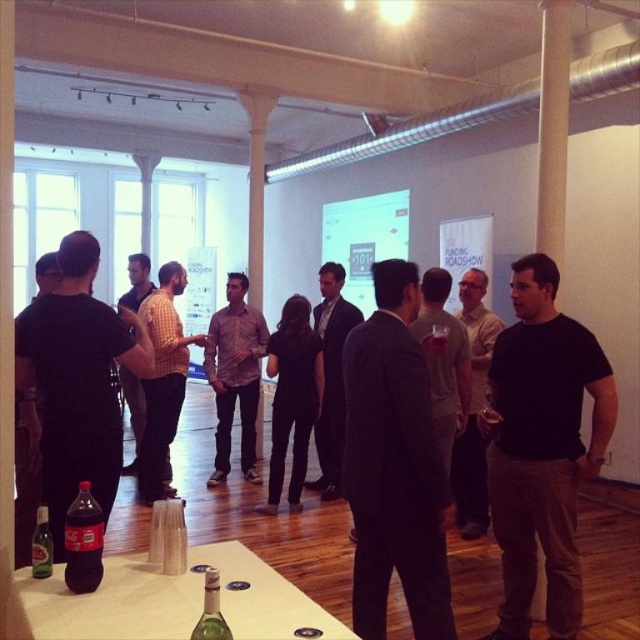
Is plaid shirt at center above dark brown glass coca-cola bottle at lower left?

Correct, plaid shirt at center is located above dark brown glass coca-cola bottle at lower left.

Image resolution: width=640 pixels, height=640 pixels. Describe the element at coordinates (236, 376) in the screenshot. I see `plaid shirt at center` at that location.

This screenshot has height=640, width=640. Find the location of `plaid shirt at center`. plaid shirt at center is located at coordinates (236, 376).

Who is higher up, checkered shirt at center or dark brown glass coca-cola bottle at lower left?

Positioned higher is checkered shirt at center.

Measure the distance between checkered shirt at center and camera.

checkered shirt at center and camera are 4.40 meters apart.

The width and height of the screenshot is (640, 640). What do you see at coordinates (163, 381) in the screenshot?
I see `checkered shirt at center` at bounding box center [163, 381].

This screenshot has width=640, height=640. Find the location of `checkered shirt at center`. checkered shirt at center is located at coordinates (163, 381).

Who is lower down, green glass bottle at lower center or green glass bottle at lower left?

green glass bottle at lower left is lower down.

Find the location of a particular element. green glass bottle at lower center is located at coordinates (211, 611).

Is point (209, 579) more distant than point (33, 552)?

No, it is not.

Where is `green glass bottle at lower center`? The height and width of the screenshot is (640, 640). green glass bottle at lower center is located at coordinates (211, 611).